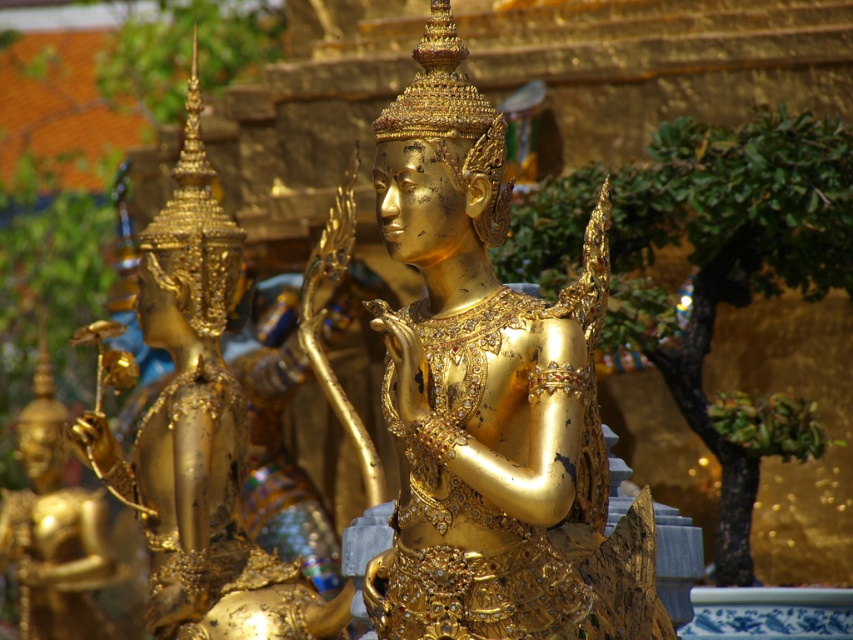
You are an art curator planning to display the shiny gold statue at center and the gold polished statue at center in a museum. Which statue should you place on the lower shelf if you want the smaller one to be more visible to visitors?

The shiny gold statue at center is smaller compared to the gold polished statue at center. To make the smaller statue more visible, place the shiny gold statue at center on the lower shelf so visitors can easily see it without obstruction.